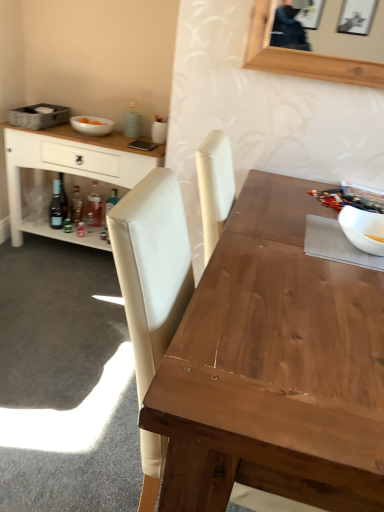
Question: Should I look upward or downward to see wooden table at center?

Choices:
 (A) down
 (B) up

Answer: (A)

Question: Considering the relative sizes of white glossy bowl at upper right, which ranks as the first bowl in bottom-to-top order, and gray woven picnic basket at upper left in the image provided, is white glossy bowl at upper right, which ranks as the first bowl in bottom-to-top order, smaller than gray woven picnic basket at upper left?

Choices:
 (A) yes
 (B) no

Answer: (A)

Question: Can you confirm if white glossy bowl at upper right, the second bowl in the top-to-bottom sequence, is positioned to the left of gray woven picnic basket at upper left?

Choices:
 (A) yes
 (B) no

Answer: (B)

Question: Can gray woven picnic basket at upper left be found inside white glossy bowl at upper right, the second bowl in the top-to-bottom sequence?

Choices:
 (A) no
 (B) yes

Answer: (A)

Question: From a real-world perspective, is white glossy bowl at upper right, which ranks as the first bowl in bottom-to-top order, on gray woven picnic basket at upper left?

Choices:
 (A) no
 (B) yes

Answer: (B)

Question: Can you confirm if white glossy bowl at upper right, the second bowl in the top-to-bottom sequence, is taller than gray woven picnic basket at upper left?

Choices:
 (A) no
 (B) yes

Answer: (B)

Question: Considering the relative sizes of white glossy bowl at upper right, the second bowl in the top-to-bottom sequence, and gray woven picnic basket at upper left in the image provided, is white glossy bowl at upper right, the second bowl in the top-to-bottom sequence, wider than gray woven picnic basket at upper left?

Choices:
 (A) yes
 (B) no

Answer: (B)

Question: From a real-world perspective, is translucent glass bottle at lower left, which is counted as the first bottle, starting from the right, beneath white glossy bowl at upper right, which is the first bowl from front to back?

Choices:
 (A) no
 (B) yes

Answer: (B)

Question: Is translucent glass bottle at lower left, which appears as the 3th bottle when viewed from the left, bigger than white glossy bowl at upper right, marked as the second bowl in a back-to-front arrangement?

Choices:
 (A) yes
 (B) no

Answer: (A)

Question: Is translucent glass bottle at lower left, which is counted as the first bottle, starting from the right, positioned in front of white glossy bowl at upper right, the second bowl in the top-to-bottom sequence?

Choices:
 (A) no
 (B) yes

Answer: (A)

Question: Is translucent glass bottle at lower left, which is counted as the first bottle, starting from the right, taller than white glossy bowl at upper right, which is the 2th bowl from left to right?

Choices:
 (A) yes
 (B) no

Answer: (A)

Question: Is translucent glass bottle at lower left, which is counted as the first bottle, starting from the right, not inside white glossy bowl at upper right, the second bowl in the top-to-bottom sequence?

Choices:
 (A) yes
 (B) no

Answer: (A)

Question: From the image's perspective, would you say translucent glass bottle at lower left, which is counted as the first bottle, starting from the right, is positioned over white glossy bowl at upper right, which ranks as the first bowl in bottom-to-top order?

Choices:
 (A) no
 (B) yes

Answer: (B)

Question: Is wooden table at center taller than translucent glass bottle at lower left, the second bottle viewed from the right?

Choices:
 (A) yes
 (B) no

Answer: (A)